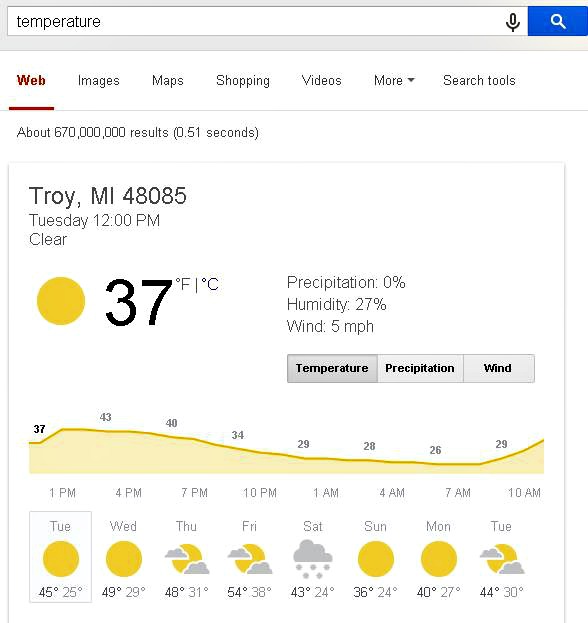
The height and width of the screenshot is (623, 588). What are the coordinates of `temperature button` in the screenshot? It's located at (322, 364).